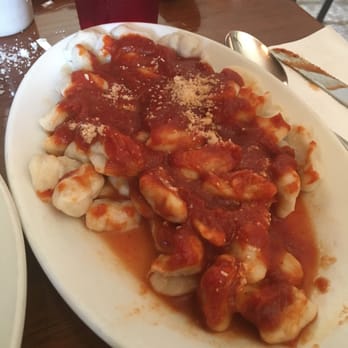
The width and height of the screenshot is (348, 348). I want to click on napkin, so click(322, 51).